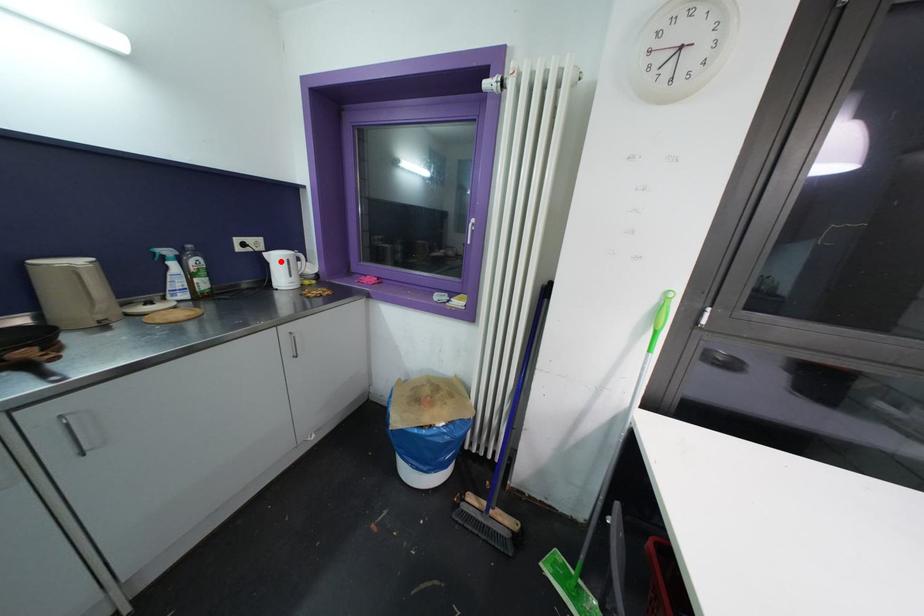
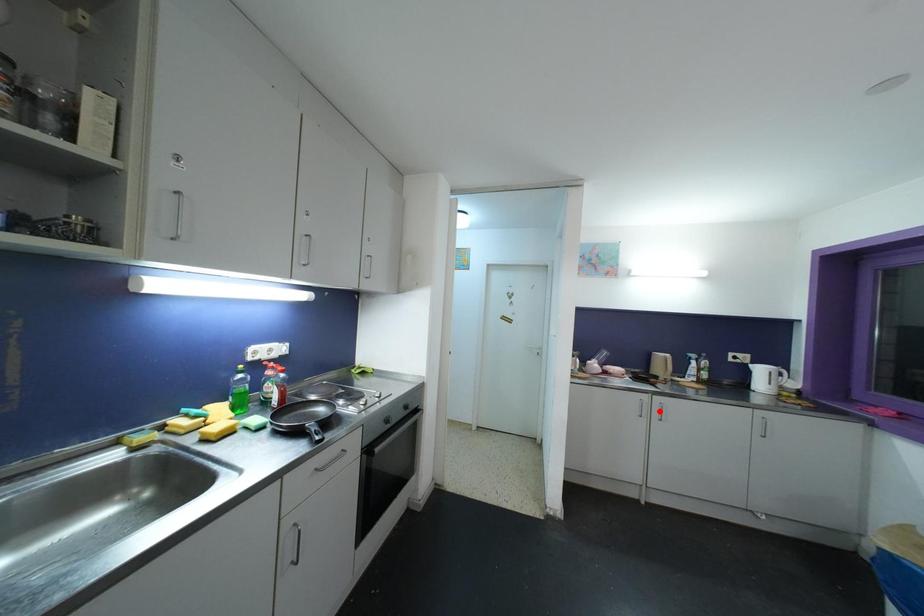
I am providing you with two images of the same scene from different viewpoints. A red point is marked on the first image and another point is marked on the second image. Is the red point in image1 aligned with the point shown in image2?

No